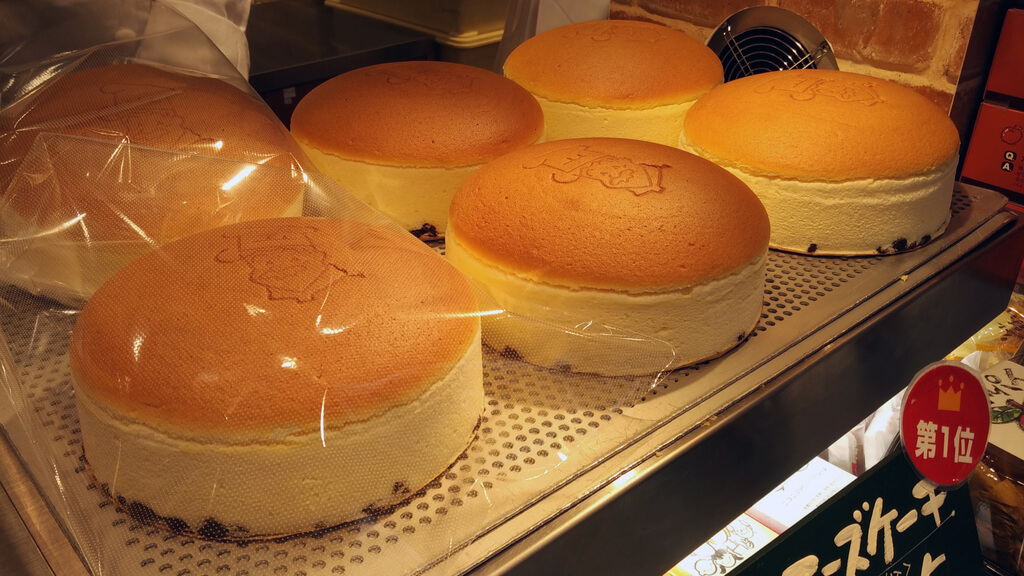
This screenshot has height=576, width=1024. Find the location of `glass window`. glass window is located at coordinates (820, 473).